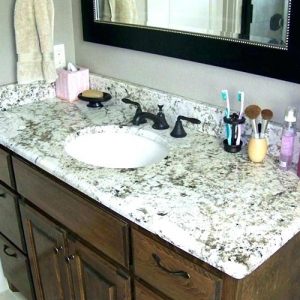
Identify the location of hot water handle. (129, 101).